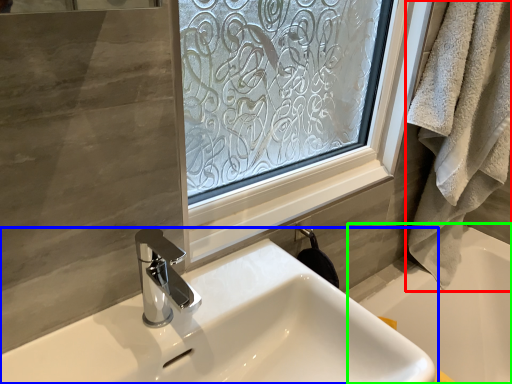
Question: Which is farther away from bath towel (highlighted by a red box)? sink (highlighted by a blue box) or bath (highlighted by a green box)?

Choices:
 (A) sink
 (B) bath

Answer: (A)